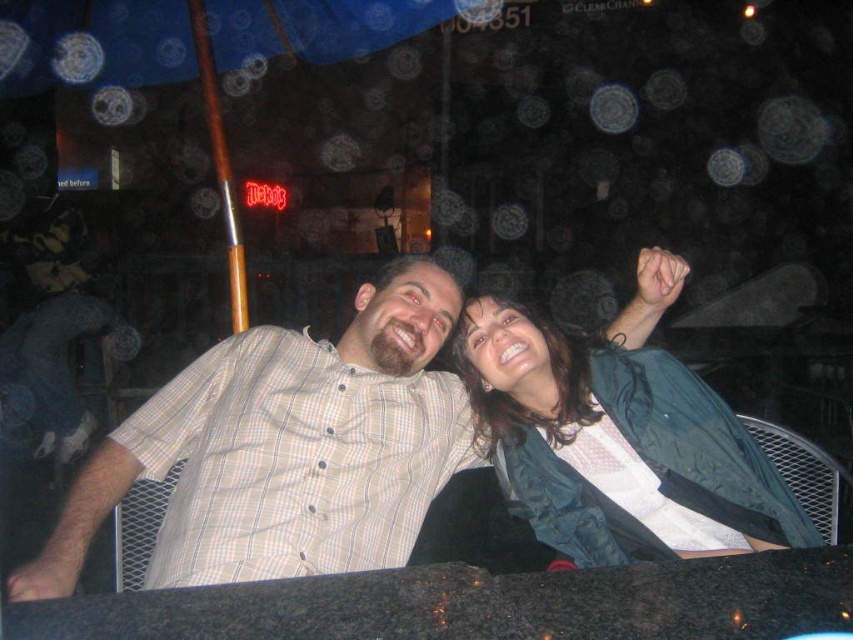
You are standing in front of the outdoor dining area at Moe. You notice two points marked in the scene. The first point is at coordinates point (509, 323), and the second point is at point (54, 307). Which of these points is nearer to your current position?

Point (509, 323) is closer to the viewer than point (54, 307), so the first point is nearer to your current position.

You are a photographer trying to capture a candid shot of both the plaid shirt at center and the light brown plaid shirt at left. Since you want to ensure both are visible in the frame, which shirt should you focus on first to avoid blocking the view of the other?

The plaid shirt at center is positioned under the light brown plaid shirt at left, so you should focus on the light brown plaid shirt at left first to avoid blocking the view of the plaid shirt at center.

You are a photographer trying to capture a candid shot of both the green fabric jacket at upper right and the light brown plaid shirt at left. Since you want to ensure both subjects are in focus, you need to know their positions relative to each other. Which object is closer to the camera, and which is farther away?

The green fabric jacket at upper right is in front of the light brown plaid shirt at left, meaning the green fabric jacket at upper right is closer to the camera while the light brown plaid shirt at left is farther away.